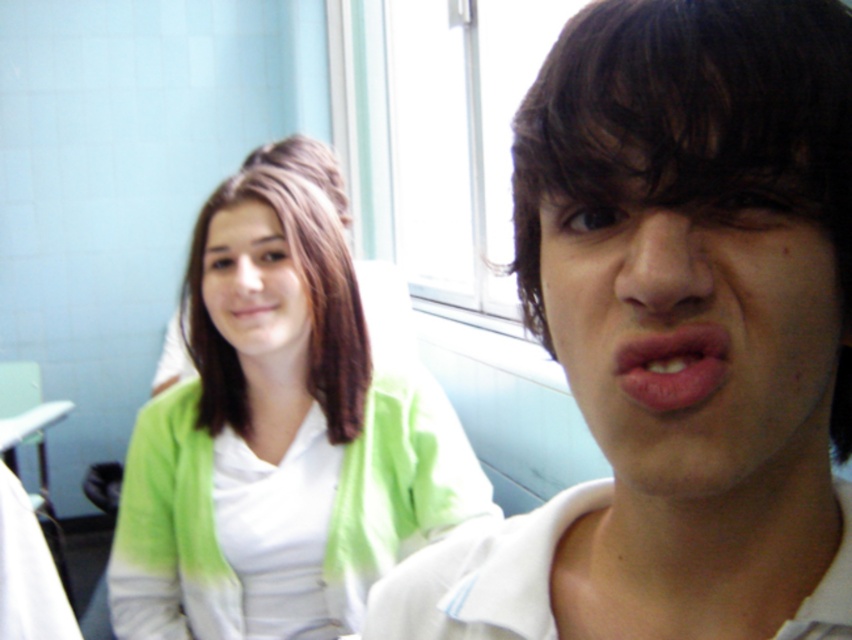
You are standing in a classroom and see two points marked in the image. Which point, point (545, 637) or point (252, 152), is closer to you?

Point (545, 637) is closer to the viewer than point (252, 152).

You are a photographer standing in a classroom setting. You want to capture a photo of the green fabric cardigan at upper left without including the person in the foreground. Is the distance sufficient to focus on the cardigan while blurring the foreground person?

The green fabric cardigan at upper left is 3.39 feet away from the camera. Since the foreground person is closer, using a shallow depth of field could blur them while keeping the cardigan in focus, provided the camera settings allow for that distance difference.

You are standing in a classroom and see a point marked at coordinates (280, 433). What object is located at that point?

The point at coordinates (280, 433) indicates the green fabric cardigan at upper left.